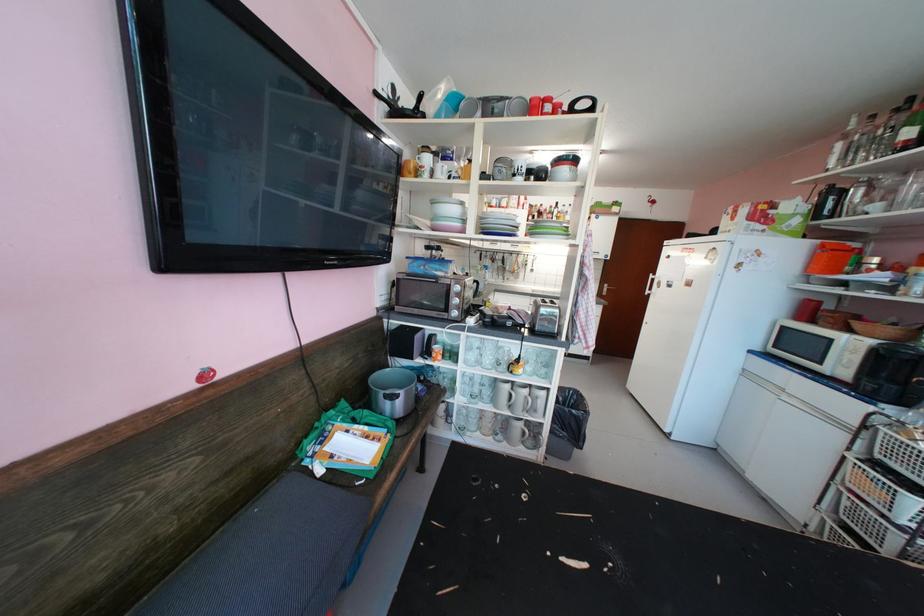
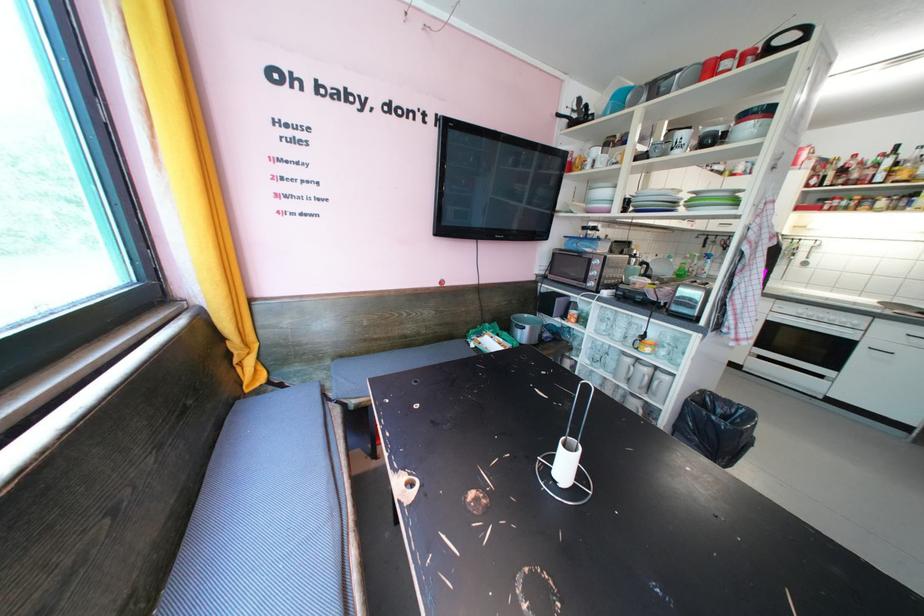
Find the pixel in the second image that matches (568,400) in the first image.

(727, 413)